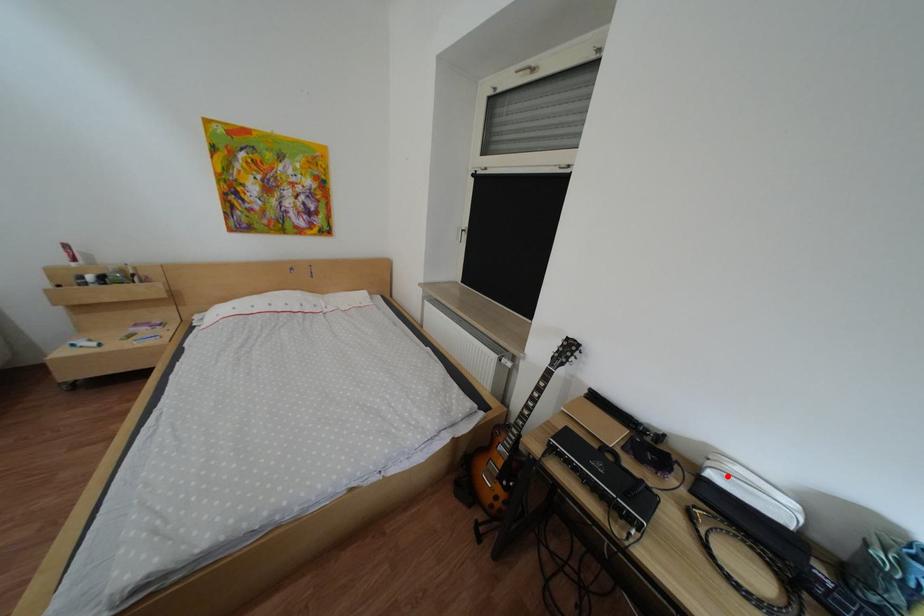
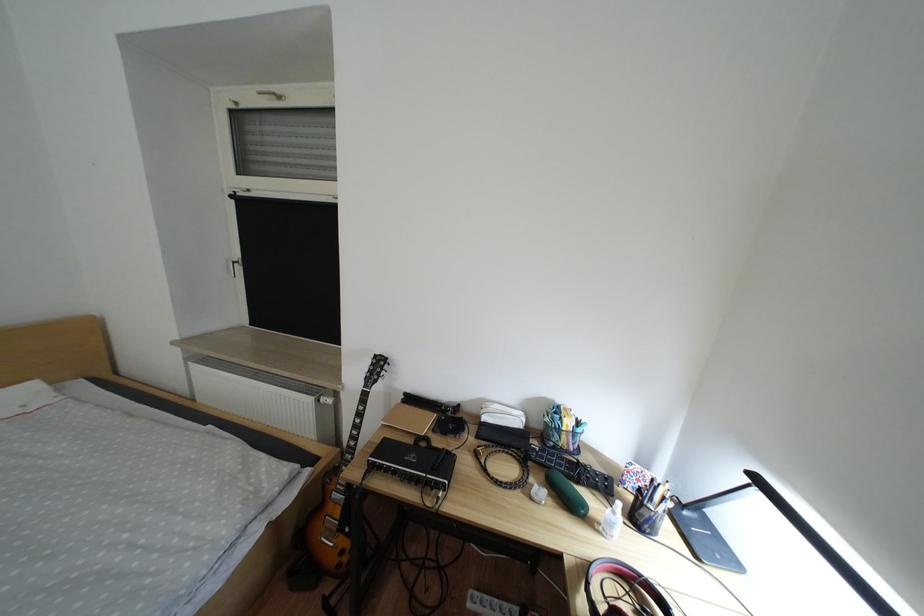
Find the pixel in the second image that matches the highlighted location in the first image.

(501, 419)